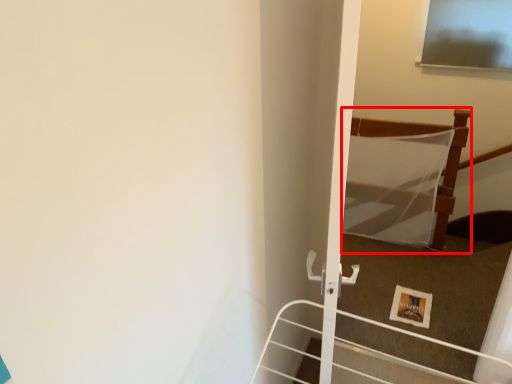
Question: In this image, where is bed (annotated by the red box) located relative to picture frame?

Choices:
 (A) left
 (B) right

Answer: (B)